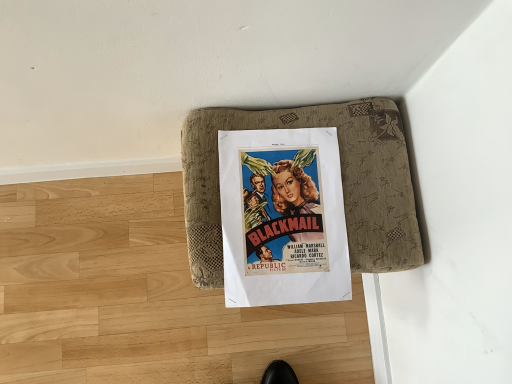
What do you see at coordinates (283, 217) in the screenshot? I see `matte paper poster at center` at bounding box center [283, 217].

I want to click on matte paper poster at center, so click(x=283, y=217).

In order to click on matte paper poster at center in this screenshot , I will do `click(283, 217)`.